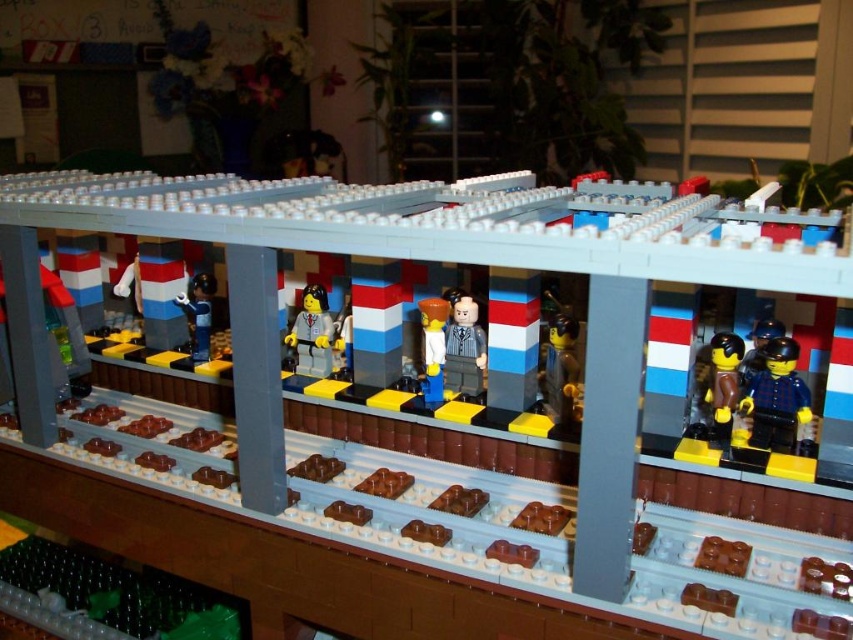
Locate an element on the screen. translucent yellow plastic figure at center is located at coordinates (433, 346).

Is translucent yellow plastic figure at center taller than matte blue minifigure at left?

Indeed, translucent yellow plastic figure at center has a greater height compared to matte blue minifigure at left.

Measure the distance between point (439,324) and camera.

Point (439,324) and camera are 1.20 meters apart from each other.

The width and height of the screenshot is (853, 640). I want to click on translucent yellow plastic figure at center, so click(x=433, y=346).

Does point (460, 376) come farther from viewer compared to point (206, 282)?

No.

From the picture: Can you confirm if matte gray suit at center is bigger than matte blue minifigure at left?

Actually, matte gray suit at center might be smaller than matte blue minifigure at left.

Between point (468, 312) and point (193, 328), which one is positioned behind?

Point (193, 328)

This screenshot has width=853, height=640. Find the location of `matte gray suit at center`. matte gray suit at center is located at coordinates (463, 346).

Who is lower down, blue checkered shirt at right or translucent yellow plastic figure at center?

blue checkered shirt at right is lower down.

Between point (761, 419) and point (430, 356), which one is positioned behind?

Point (430, 356)

You are a GUI agent. You are given a task and a screenshot of the screen. Output one action in this format:
    pyautogui.click(x=<x>, y=<y>)
    Task: Click on the blue checkered shirt at right
    The width and height of the screenshot is (853, 640).
    Given the screenshot: What is the action you would take?
    pyautogui.click(x=776, y=397)

At what (x,y) coordinates should I click in order to perform the action: click on blue checkered shirt at right. Please return your answer as a coordinate pair (x, y). Image resolution: width=853 pixels, height=640 pixels. Looking at the image, I should click on (776, 397).